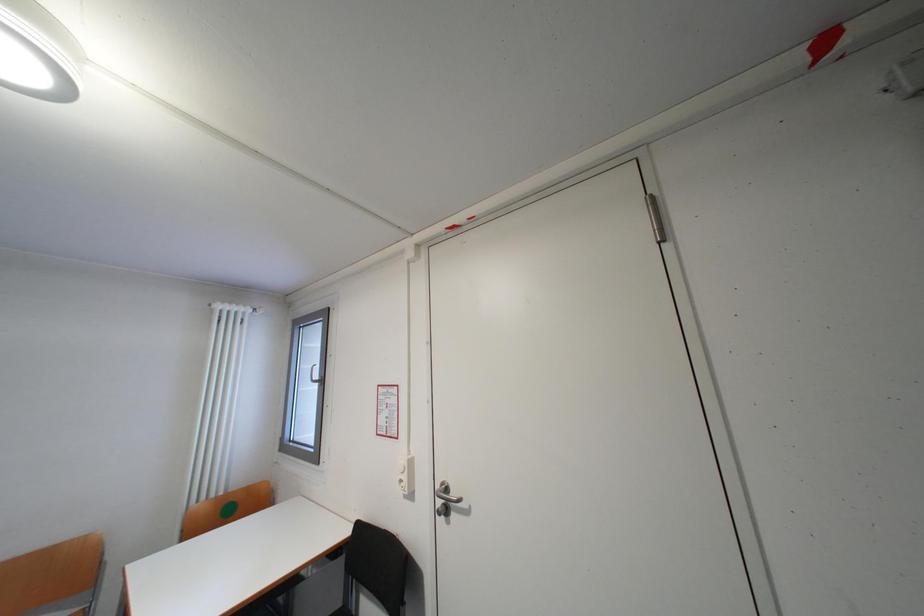
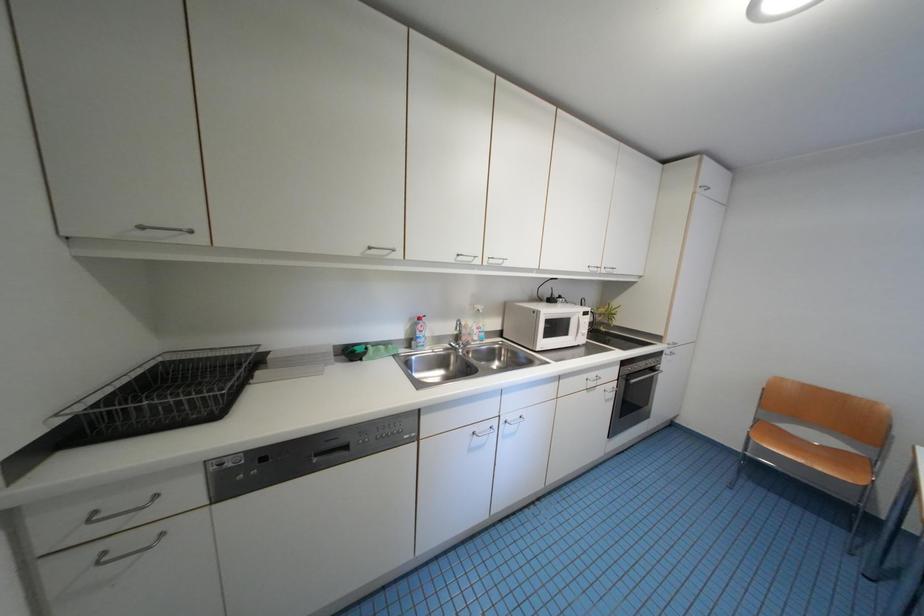
Question: How did the camera likely rotate?

Choices:
 (A) Left
 (B) Right
 (C) Up
 (D) Down

Answer: (A)